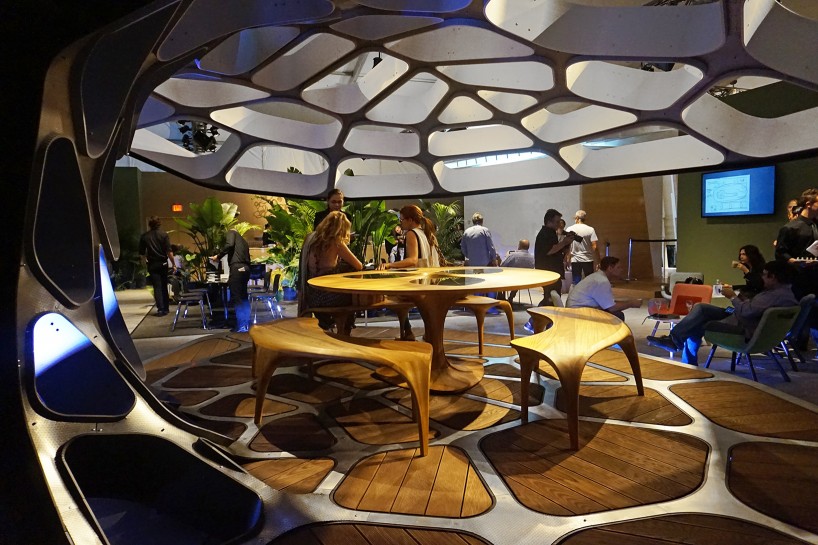
Identify the location of brown wall background right side. (160, 193), (182, 193).